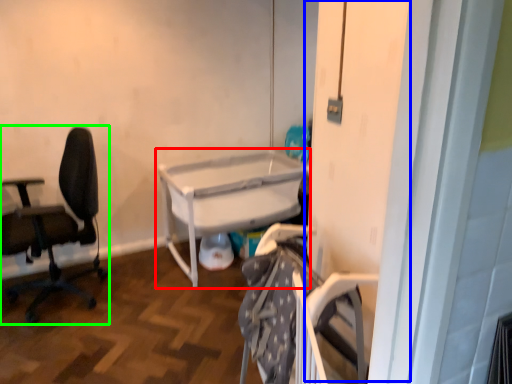
Question: Considering the real-world distances, which object is farthest from table (highlighted by a red box)? screen door (highlighted by a blue box) or chair (highlighted by a green box)?

Choices:
 (A) screen door
 (B) chair

Answer: (A)